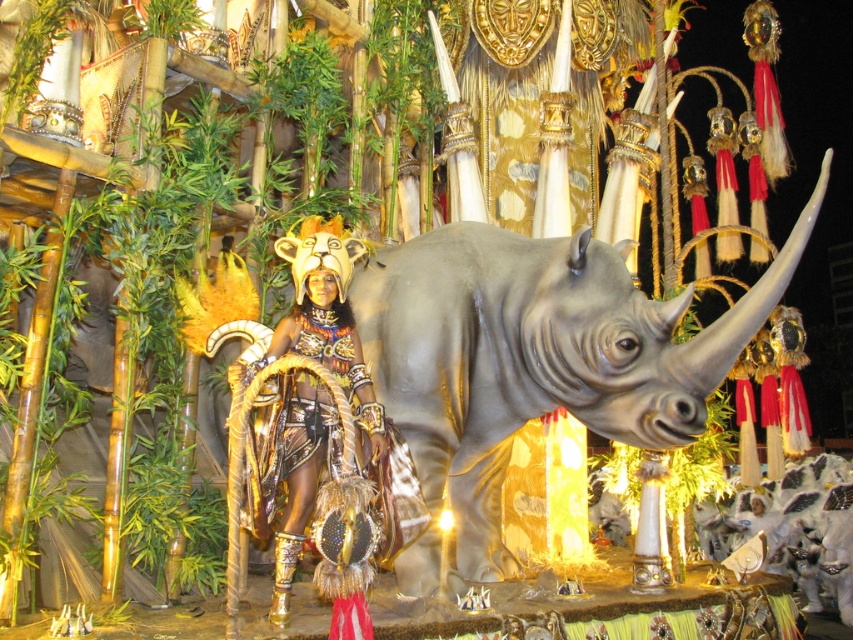
Question: Which of the following is the closest to the observer?

Choices:
 (A) (547, 244)
 (B) (354, 387)

Answer: (B)

Question: Does gray matte rhinoceros at center appear on the left side of metallic gold headdress at center?

Choices:
 (A) yes
 (B) no

Answer: (B)

Question: Among these points, which one is farthest from the camera?

Choices:
 (A) (247, 452)
 (B) (473, 531)

Answer: (B)

Question: Is gray matte rhinoceros at center positioned before metallic gold headdress at center?

Choices:
 (A) no
 (B) yes

Answer: (A)

Question: Can you confirm if gray matte rhinoceros at center is thinner than metallic gold headdress at center?

Choices:
 (A) yes
 (B) no

Answer: (B)

Question: Among these objects, which one is farthest from the camera?

Choices:
 (A) gray matte rhinoceros at center
 (B) metallic gold headdress at center

Answer: (A)